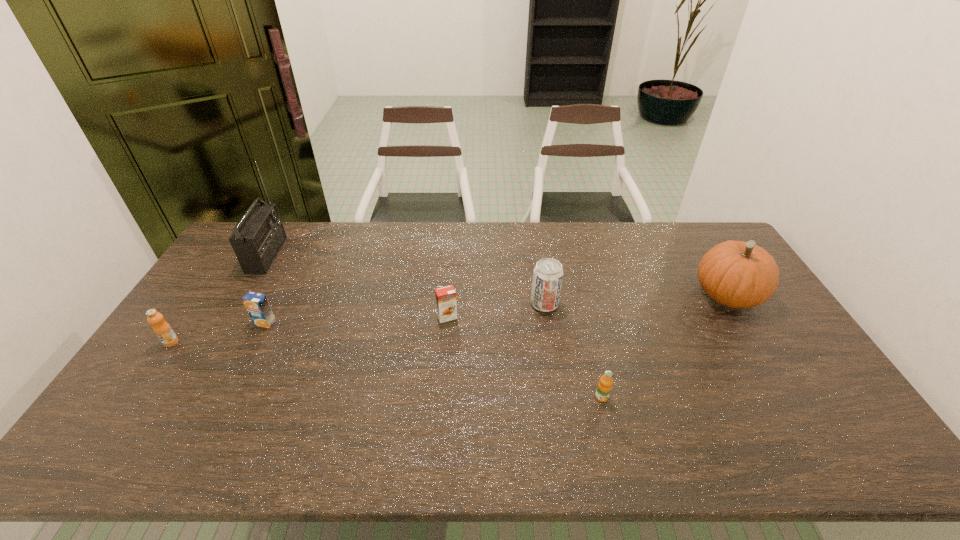
The height and width of the screenshot is (540, 960). What are the coordinates of `vacant space at the far right corner` in the screenshot? It's located at (683, 243).

Locate an element on the screen. The image size is (960, 540). vacant space that is in between the nearest object and the sixth shortest object is located at coordinates (664, 346).

Where is `vacant space in between the third orange juice from left to right and the second nearest orange juice`? This screenshot has width=960, height=540. vacant space in between the third orange juice from left to right and the second nearest orange juice is located at coordinates (309, 330).

I want to click on free space between the second orange juice from left to right and the pumpkin, so pos(496,309).

The height and width of the screenshot is (540, 960). What are the coordinates of `empty space between the third object from right to left and the fourth object from right to left` in the screenshot? It's located at (495, 310).

The height and width of the screenshot is (540, 960). Find the location of `vacant space that is in between the third object from left to right and the leftmost orange juice`. vacant space that is in between the third object from left to right and the leftmost orange juice is located at coordinates (218, 333).

You are a GUI agent. You are given a task and a screenshot of the screen. Output one action in this format:
    pyautogui.click(x=<x>, y=<y>)
    Task: Click on the vacant space that is in between the rightmost object and the second object from left to right
    
    Given the screenshot: What is the action you would take?
    pyautogui.click(x=497, y=275)

What are the coordinates of `vacant area between the third object from right to left and the fourth object from right to left` in the screenshot? It's located at (495, 310).

Locate an element on the screen. The image size is (960, 540). vacant area between the fourth object from left to right and the soda can is located at coordinates (495, 310).

I want to click on empty space between the tallest object and the rightmost object, so click(497, 275).